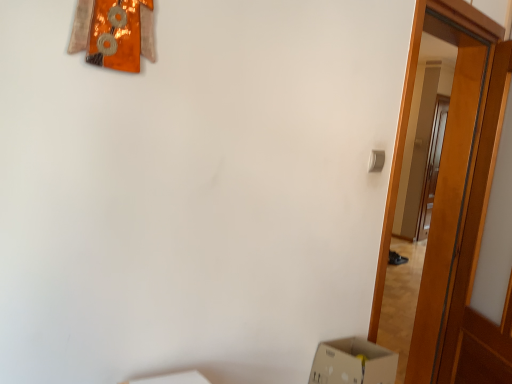
Question: From the image's perspective, is wooden door at right, acting as the 1th door starting from the right, above or below wooden door at right, which is the 1th door in left-to-right order?

Choices:
 (A) below
 (B) above

Answer: (A)

Question: Does point (484, 370) appear closer or farther from the camera than point (458, 173)?

Choices:
 (A) farther
 (B) closer

Answer: (B)

Question: Considering the positions of wooden door at right, acting as the 1th door starting from the right, and wooden door at right, the second door in the right-to-left sequence, in the image, is wooden door at right, acting as the 1th door starting from the right, wider or thinner than wooden door at right, the second door in the right-to-left sequence,?

Choices:
 (A) thin
 (B) wide

Answer: (A)

Question: Considering the positions of wooden door at right, which is the 1th door in left-to-right order, and wooden door at right, acting as the 2th door starting from the left, in the image, is wooden door at right, which is the 1th door in left-to-right order, taller or shorter than wooden door at right, acting as the 2th door starting from the left,?

Choices:
 (A) short
 (B) tall

Answer: (B)

Question: Is wooden door at right, the second door in the right-to-left sequence, spatially inside wooden door at right, acting as the 2th door starting from the left, or outside of it?

Choices:
 (A) outside
 (B) inside

Answer: (A)

Question: From the image's perspective, is wooden door at right, the second door in the right-to-left sequence, located above or below wooden door at right, acting as the 1th door starting from the right?

Choices:
 (A) above
 (B) below

Answer: (A)

Question: Considering the positions of point (393, 221) and point (456, 332), is point (393, 221) closer or farther from the camera than point (456, 332)?

Choices:
 (A) farther
 (B) closer

Answer: (B)